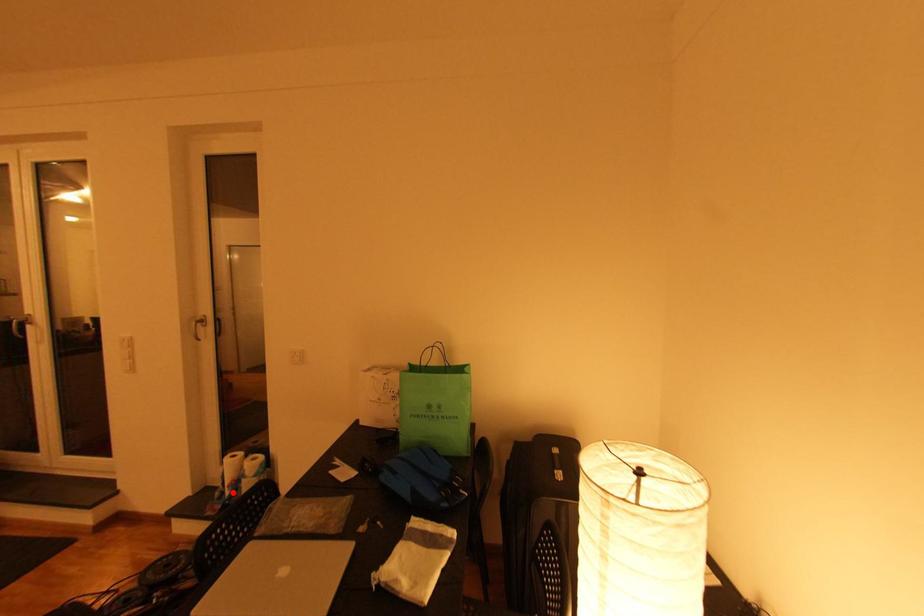
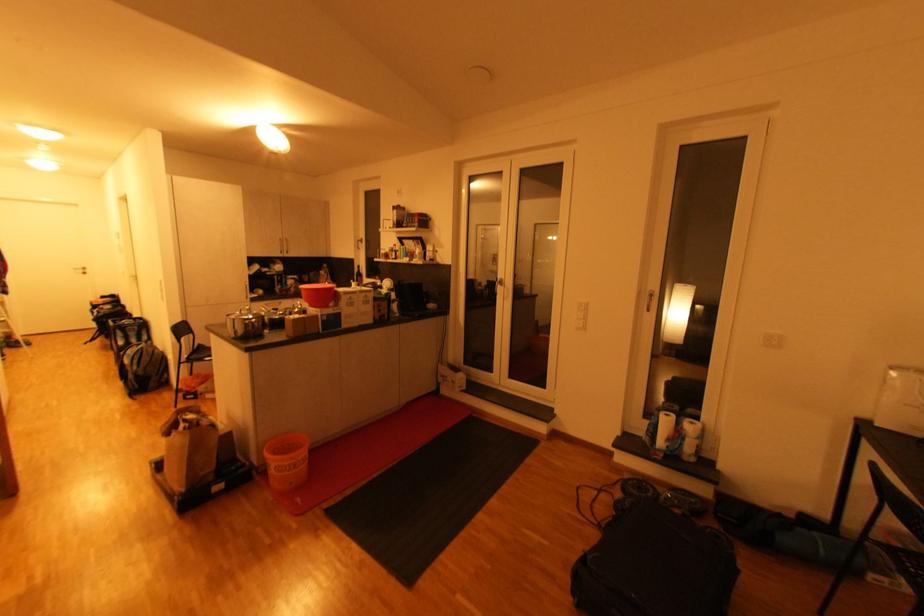
Where in the second image is the point corresponding to the highlighted location from the first image?

(665, 444)